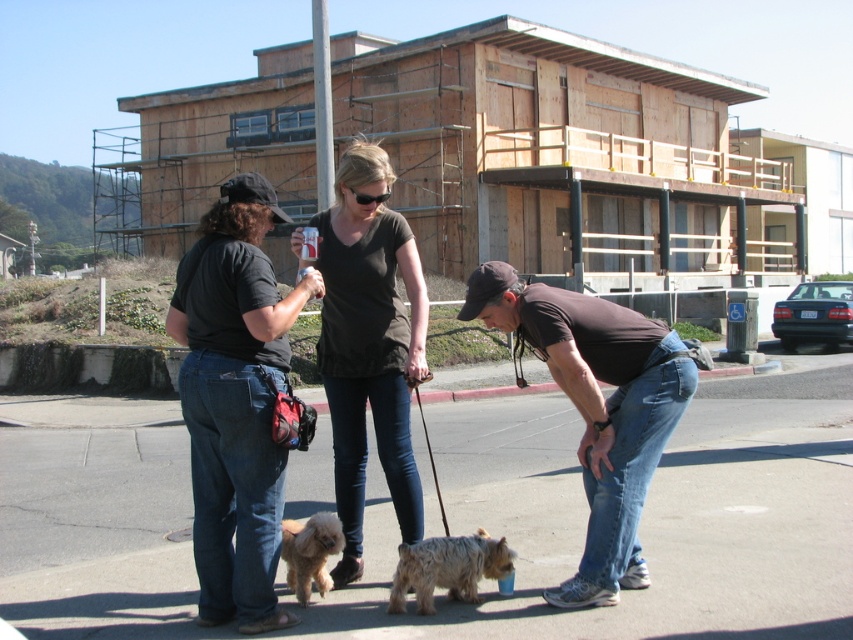
Question: Which of the following is the farthest from the observer?

Choices:
 (A) fluffy golden dog at center
 (B) black matte shirt at center
 (C) brown cotton shirt at lower center

Answer: (B)

Question: Can you confirm if brown cotton shirt at lower center is positioned below fluffy golden dog at center?

Choices:
 (A) no
 (B) yes

Answer: (A)

Question: In this image, where is dark gray t-shirt at left located relative to brown cotton shirt at lower center?

Choices:
 (A) below
 (B) above

Answer: (B)

Question: Which point is farther from the camera taking this photo?

Choices:
 (A) (427, 605)
 (B) (392, 500)
 (C) (262, 502)
 (D) (619, 339)

Answer: (B)

Question: Considering the real-world distances, which object is farthest from the smooth asphalt pavement at center?

Choices:
 (A) shaggy tan dog at center
 (B) fluffy golden dog at center
 (C) brown cotton shirt at lower center

Answer: (C)

Question: Is smooth asphalt pavement at center positioned at the back of fluffy golden dog at center?

Choices:
 (A) yes
 (B) no

Answer: (B)